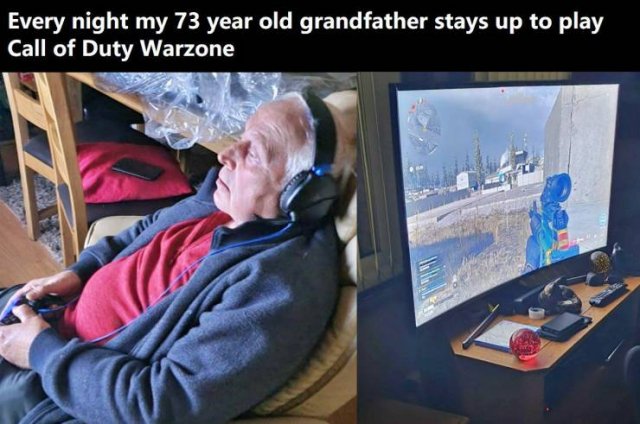
Find the location of `pillow`. pillow is located at coordinates (125, 192).